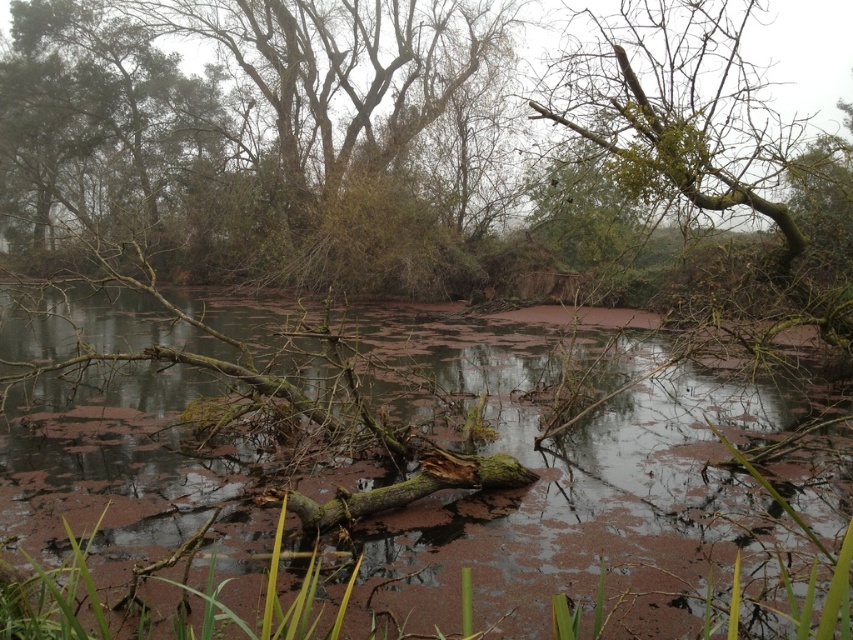
You are standing at the edge of the water body in the scene. There is a point marked at coordinates point (651, 413). Can you reach that point without getting your shoes wet?

The point (651, 413) is 28.77 feet away from viewer, so yes, you can reach it without getting your shoes wet since it is far enough from the water edge.

You are a nature photographer planning to capture the brown mossy log at center and the green mossy branch at upper right in a single frame. Given their sizes, which object will appear bigger in the photo?

The brown mossy log at center will appear bigger in the photo because it has a larger size compared to the green mossy branch at upper right.

You are a nature photographer aiming to capture the brown mossy log at center and the green mossy branch at upper right in the same frame. Based on their positions, which object should you focus on first to ensure both are in the shot?

The brown mossy log at center is to the left of the green mossy branch at upper right, so focusing on the brown mossy log at center first would allow you to frame both objects by adjusting the camera to include the green mossy branch at upper right positioned to its right.